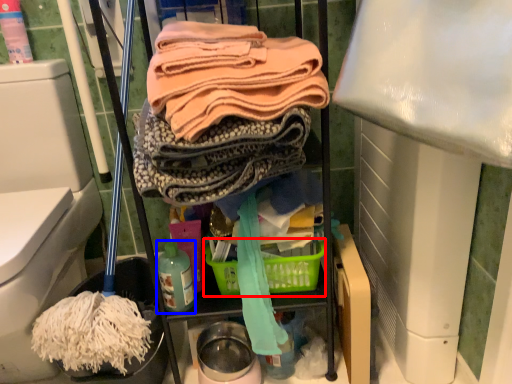
Question: Which object appears closest to the camera in this image, basket (highlighted by a red box) or bottle (highlighted by a blue box)?

Choices:
 (A) basket
 (B) bottle

Answer: (B)